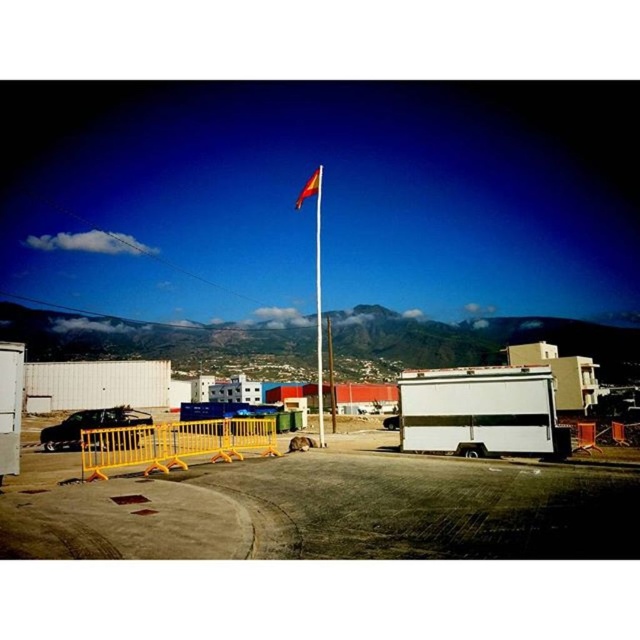
In the scene shown: You are a delivery driver approaching the construction site shown in the image. You need to park your truck, which is 2 meters wide, between the yellow plastic barricade at lower left and the metallic flag pole at center. Is there enough space for your truck?

The yellow plastic barricade at lower left is positioned under the metallic flag pole at center, which means they are aligned vertically. Since the truck is 2 meters wide, but the space between them is narrow vertically, there might not be enough lateral space for the truck to fit between them. However, without specific distance measurements, it is difficult to confirm. Please check the exact dimensions before attempting to park.

You are a delivery driver approaching the construction site. You need to park your truck, which is 2.5 meters wide, between the yellow plastic barricade at lower left and the metallic flag pole at center. Can your truck fit in the space between them?

The yellow plastic barricade at lower left is wider than the metallic flag pole at center. However, the question is about the space between them, not their widths. Without information on the distance between the barricade and the flag pole, we cannot determine if the truck can fit. Please provide the distance between the two objects.